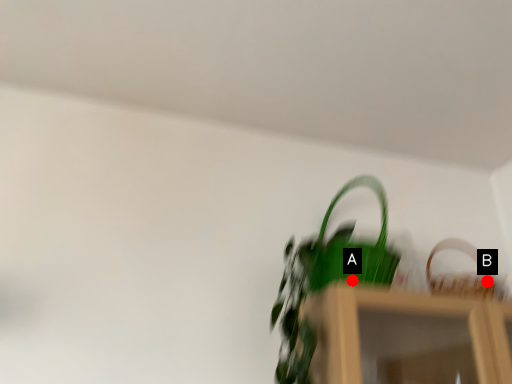
Question: Two points are circled on the image, labeled by A and B beside each circle. Among these points, which one is farthest from the camera?

Choices:
 (A) A is further
 (B) B is further

Answer: (B)